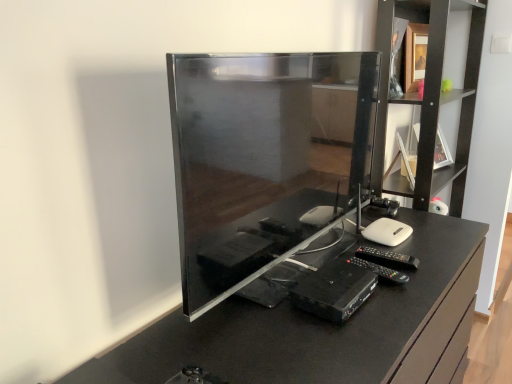
In order to face black wood shelf at upper right, should I rotate leftwards or rightwards?

Rotate right and turn 22.108 degrees.

The width and height of the screenshot is (512, 384). What do you see at coordinates (264, 159) in the screenshot?
I see `matte black desktop computer at center` at bounding box center [264, 159].

Identify the location of glossy black tv at center. (318, 327).

The height and width of the screenshot is (384, 512). Find the location of `black wood shelf at upper right`. black wood shelf at upper right is located at coordinates (426, 101).

Which is farther, (417, 365) or (461, 179)?

Positioned behind is point (461, 179).

What are the coordinates of `shelf lying on the right of glossy black tv at center` in the screenshot? It's located at (426, 101).

Is glossy black tv at center closer to the viewer compared to black wood shelf at upper right?

Yes, glossy black tv at center is in front of black wood shelf at upper right.

Could you tell me if glossy black tv at center is turned towards black wood shelf at upper right?

No, glossy black tv at center is not aimed at black wood shelf at upper right.

In order to click on equipment in front of the black wood shelf at upper right in this screenshot , I will do `click(334, 290)`.

Does black wood shelf at upper right have a greater width compared to black plastic dvd player at center?

Indeed, black wood shelf at upper right has a greater width compared to black plastic dvd player at center.

Is black wood shelf at upper right placed right next to black plastic dvd player at center?

No, black wood shelf at upper right is not beside black plastic dvd player at center.

In terms of width, does glossy black tv at center look wider or thinner when compared to matte black desktop computer at center?

Clearly, glossy black tv at center has more width compared to matte black desktop computer at center.

In the image, is glossy black tv at center on the left side or the right side of matte black desktop computer at center?

glossy black tv at center is to the right of matte black desktop computer at center.

Locate an element on the screen. furniture below the matte black desktop computer at center (from the image's perspective) is located at coordinates (318, 327).

From a real-world perspective, between black plastic dvd player at center and black wood shelf at upper right, who is vertically lower?

From a 3D spatial view, black plastic dvd player at center is below.

Based on the photo, which is more distant, (376, 280) or (467, 134)?

Positioned behind is point (467, 134).

Can you tell me how much black plastic dvd player at center and black wood shelf at upper right differ in facing direction?

There is a 1.37e-05-degree angle between the facing directions of black plastic dvd player at center and black wood shelf at upper right.

From the image's perspective, between black plastic dvd player at center and black wood shelf at upper right, which one is located above?

black wood shelf at upper right, from the image's perspective.

Is matte black desktop computer at center at the left side of black wood shelf at upper right?

Yes, matte black desktop computer at center is to the left of black wood shelf at upper right.

Is matte black desktop computer at center situated inside black wood shelf at upper right or outside?

matte black desktop computer at center lies outside black wood shelf at upper right.

Which of these two, matte black desktop computer at center or black wood shelf at upper right, is smaller?

With smaller size is matte black desktop computer at center.

Does matte black desktop computer at center have a greater height compared to black wood shelf at upper right?

No, matte black desktop computer at center is not taller than black wood shelf at upper right.

Is matte black desktop computer at center not inside black plastic dvd player at center?

Yes, matte black desktop computer at center is not within black plastic dvd player at center.

From the image's perspective, is matte black desktop computer at center above black plastic dvd player at center?

Correct, matte black desktop computer at center appears higher than black plastic dvd player at center in the image.

From a real-world perspective, does matte black desktop computer at center stand above black plastic dvd player at center?

Correct, in the physical world, matte black desktop computer at center is higher than black plastic dvd player at center.

Is matte black desktop computer at center facing towards black plastic dvd player at center?

Yes, matte black desktop computer at center is turned towards black plastic dvd player at center.

From the image's perspective, is black plastic dvd player at center below matte black desktop computer at center?

Yes.

At what (x,y) coordinates should I click in order to perform the action: click on equipment below the matte black desktop computer at center (from the image's perspective). Please return your answer as a coordinate pair (x, y). The image size is (512, 384). Looking at the image, I should click on (334, 290).

Is black plastic dvd player at center not close to matte black desktop computer at center?

No, black plastic dvd player at center is not far away from matte black desktop computer at center.

How different are the orientations of black plastic dvd player at center and matte black desktop computer at center in degrees?

1.45 degrees.

Where is `shelf above the glossy black tv at center (from a real-world perspective)`? This screenshot has height=384, width=512. shelf above the glossy black tv at center (from a real-world perspective) is located at coordinates (426, 101).

Where is `equipment below the black wood shelf at upper right (from a real-world perspective)`? The height and width of the screenshot is (384, 512). equipment below the black wood shelf at upper right (from a real-world perspective) is located at coordinates point(334,290).

Estimate the real-world distances between objects in this image. Which object is further from glossy black tv at center, matte black desktop computer at center or black plastic dvd player at center?

matte black desktop computer at center.

Based on their spatial positions, is black wood shelf at upper right or matte black desktop computer at center closer to black plastic dvd player at center?

matte black desktop computer at center.

Which object lies nearer to the anchor point black plastic dvd player at center, glossy black tv at center or black wood shelf at upper right?

glossy black tv at center is positioned closer to the anchor black plastic dvd player at center.

When comparing their distances from glossy black tv at center, does black wood shelf at upper right or black plastic dvd player at center seem further?

Based on the image, black wood shelf at upper right appears to be further to glossy black tv at center.

When comparing their distances from matte black desktop computer at center, does black plastic dvd player at center or black wood shelf at upper right seem further?

black wood shelf at upper right is further to matte black desktop computer at center.

When comparing their distances from matte black desktop computer at center, does black wood shelf at upper right or black plastic dvd player at center seem further?

black wood shelf at upper right is positioned further to the anchor matte black desktop computer at center.

When comparing their distances from glossy black tv at center, does black wood shelf at upper right or matte black desktop computer at center seem further?

Among the two, black wood shelf at upper right is located further to glossy black tv at center.

When comparing their distances from black plastic dvd player at center, does glossy black tv at center or matte black desktop computer at center seem closer?

The object closer to black plastic dvd player at center is glossy black tv at center.

At what (x,y) coordinates should I click in order to perform the action: click on equipment between matte black desktop computer at center and glossy black tv at center from top to bottom. Please return your answer as a coordinate pair (x, y). This screenshot has width=512, height=384. Looking at the image, I should click on pos(334,290).

Locate an element on the screen. The width and height of the screenshot is (512, 384). equipment situated between matte black desktop computer at center and black wood shelf at upper right from left to right is located at coordinates click(x=334, y=290).

The image size is (512, 384). In order to click on equipment between black wood shelf at upper right and glossy black tv at center from top to bottom in this screenshot , I will do `click(334, 290)`.

You are a GUI agent. You are given a task and a screenshot of the screen. Output one action in this format:
    pyautogui.click(x=<x>, y=<y>)
    Task: Click on the desktop computer between glossy black tv at center and black wood shelf at upper right in the front-back direction
    
    Given the screenshot: What is the action you would take?
    pyautogui.click(x=264, y=159)